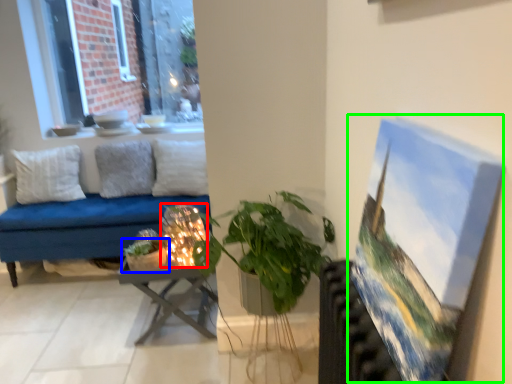
Question: Which is farther away from candle holder (highlighted by a red box)? houseplant (highlighted by a blue box) or oil painting (highlighted by a green box)?

Choices:
 (A) houseplant
 (B) oil painting

Answer: (B)